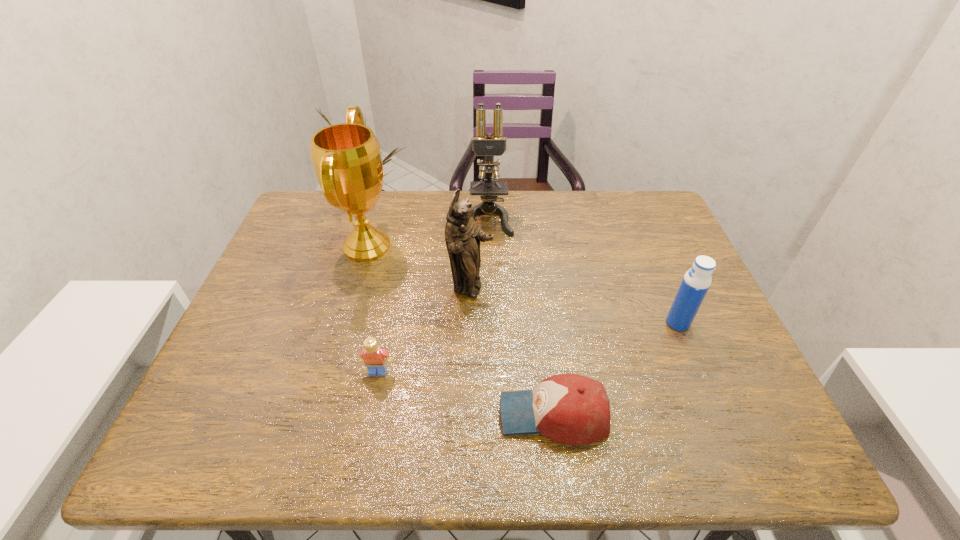
The image size is (960, 540). In the image, there is a desktop. Identify the location of free space at the near edge. (636, 450).

In the image, there is a desktop. Where is `vacant space at the left edge`? This screenshot has width=960, height=540. vacant space at the left edge is located at coordinates (299, 244).

Find the location of a particular element. This screenshot has width=960, height=540. free space at the right edge of the desktop is located at coordinates (740, 407).

Image resolution: width=960 pixels, height=540 pixels. I want to click on vacant space at the far left corner of the desktop, so (321, 191).

The width and height of the screenshot is (960, 540). I want to click on free region at the far right corner of the desktop, so click(x=647, y=213).

Locate an element on the screen. vacant space at the near right corner is located at coordinates (704, 428).

The height and width of the screenshot is (540, 960). What are the coordinates of `free spot between the second nearest object and the microscope` in the screenshot? It's located at click(x=433, y=295).

Locate an element on the screen. This screenshot has height=540, width=960. free space between the fourth shortest object and the baseball cap is located at coordinates (512, 352).

Where is `free space between the nearest object and the fourth shortest object`? This screenshot has height=540, width=960. free space between the nearest object and the fourth shortest object is located at coordinates (512, 352).

Image resolution: width=960 pixels, height=540 pixels. Find the location of `vacant space that is in between the nearest object and the microscope`. vacant space that is in between the nearest object and the microscope is located at coordinates (520, 316).